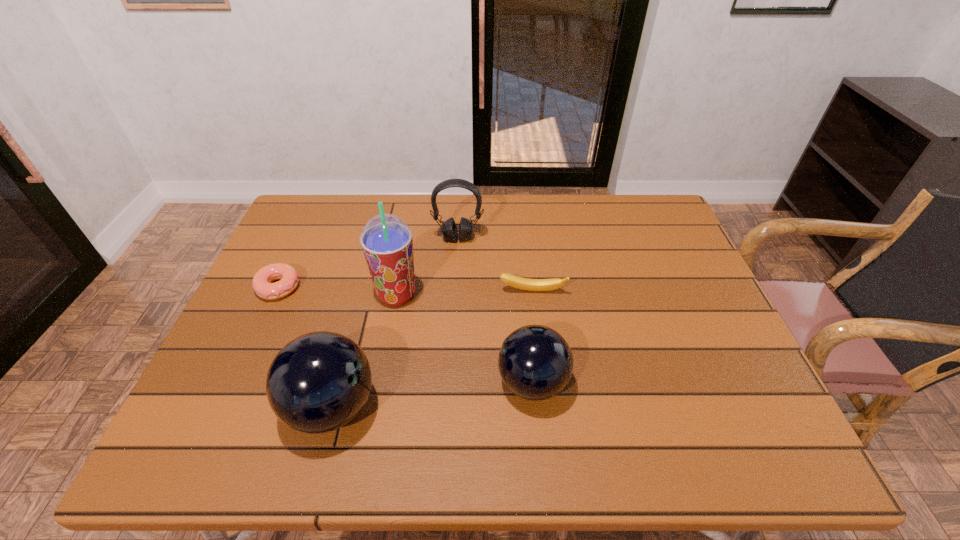
Locate an element on the screen. This screenshot has height=540, width=960. vacant area that lies between the farthest object and the smoothie is located at coordinates (427, 267).

You are a GUI agent. You are given a task and a screenshot of the screen. Output one action in this format:
    pyautogui.click(x=<x>, y=<y>)
    Task: Click on the vacant area that lies between the second shortest object and the taller bowling ball
    The image size is (960, 540).
    Given the screenshot: What is the action you would take?
    pyautogui.click(x=432, y=349)

Where is `object that is the second nearest to the leftmost object`? This screenshot has height=540, width=960. object that is the second nearest to the leftmost object is located at coordinates (318, 382).

At what (x,y) coordinates should I click in order to perform the action: click on object that ranks as the fifth closest to the left bowling ball. Please return your answer as a coordinate pair (x, y). Looking at the image, I should click on (449, 229).

At what (x,y) coordinates should I click in order to perform the action: click on free spot that satisfies the following two spatial constraints: 1. on the front side of the smoothie; 2. on the right side of the leftmost object. Please return your answer as a coordinate pair (x, y). This screenshot has height=540, width=960. Looking at the image, I should click on (276, 295).

At what (x,y) coordinates should I click in order to perform the action: click on vacant point that satisfies the following two spatial constraints: 1. at the stem of the banana; 2. on the side of the taller bowling ball with the finger holes. Please return your answer as a coordinate pair (x, y). The image size is (960, 540). Looking at the image, I should click on coord(546,407).

Image resolution: width=960 pixels, height=540 pixels. Find the location of `vacant space that satisfies the following two spatial constraints: 1. at the stem of the second shortest object; 2. on the side of the third shortest object with the finger holes`. vacant space that satisfies the following two spatial constraints: 1. at the stem of the second shortest object; 2. on the side of the third shortest object with the finger holes is located at coordinates (543, 383).